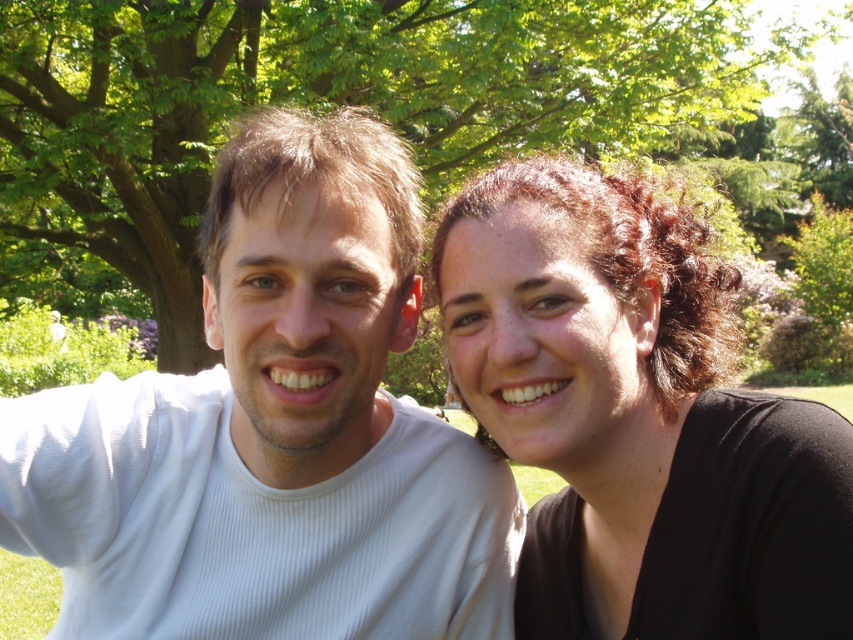
Question: Among these objects, which one is nearest to the camera?

Choices:
 (A) green leafy tree at upper center
 (B) matte black hair at right
 (C) white ribbed shirt at left

Answer: (B)

Question: Which of the following is the farthest from the observer?

Choices:
 (A) (463, 589)
 (B) (732, 353)
 (C) (587, 12)

Answer: (C)

Question: Among these points, which one is nearest to the camera?

Choices:
 (A) (341, 580)
 (B) (630, 360)
 (C) (477, 72)

Answer: (B)

Question: Can you confirm if matte black hair at right is wider than green leafy tree at upper center?

Choices:
 (A) no
 (B) yes

Answer: (A)

Question: Does white ribbed shirt at left appear on the left side of green leafy tree at upper center?

Choices:
 (A) yes
 (B) no

Answer: (A)

Question: Is white ribbed shirt at left to the left of matte black hair at right from the viewer's perspective?

Choices:
 (A) no
 (B) yes

Answer: (B)